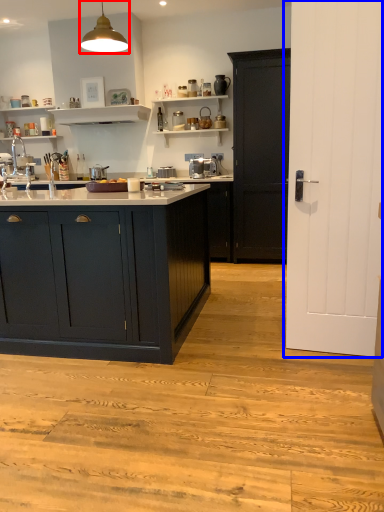
Question: Which object appears farthest to the camera in this image, light fixture (highlighted by a red box) or door (highlighted by a blue box)?

Choices:
 (A) light fixture
 (B) door

Answer: (A)